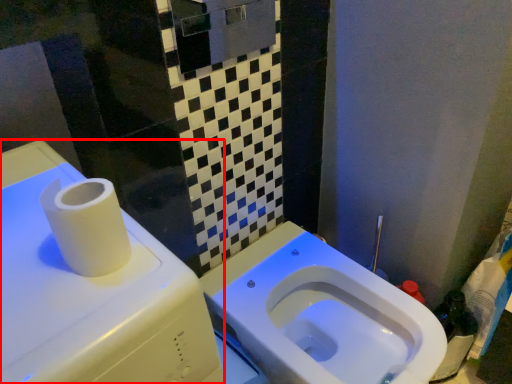
Question: From the image's perspective, what is the correct spatial relationship of water tank (annotated by the red box) in relation to toilet?

Choices:
 (A) below
 (B) above

Answer: (B)